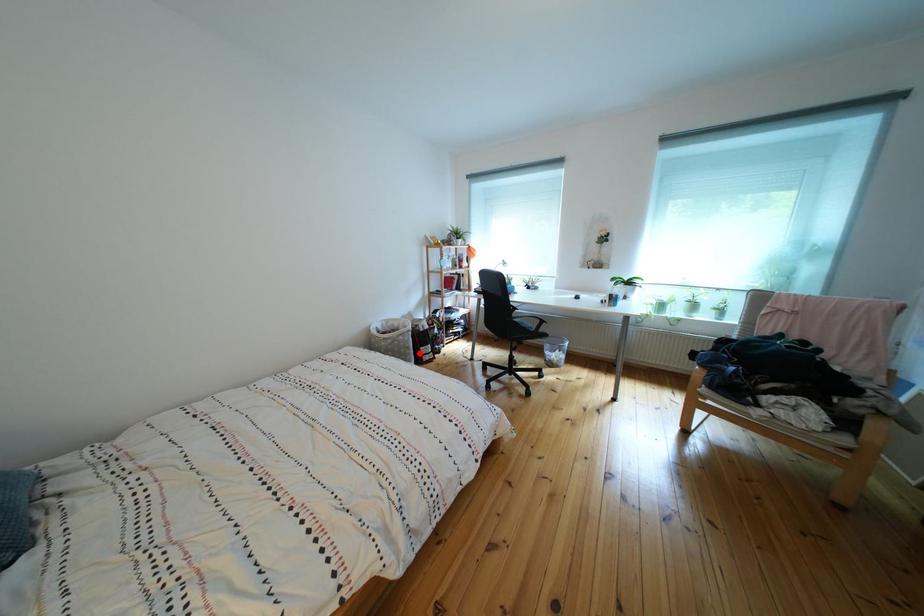
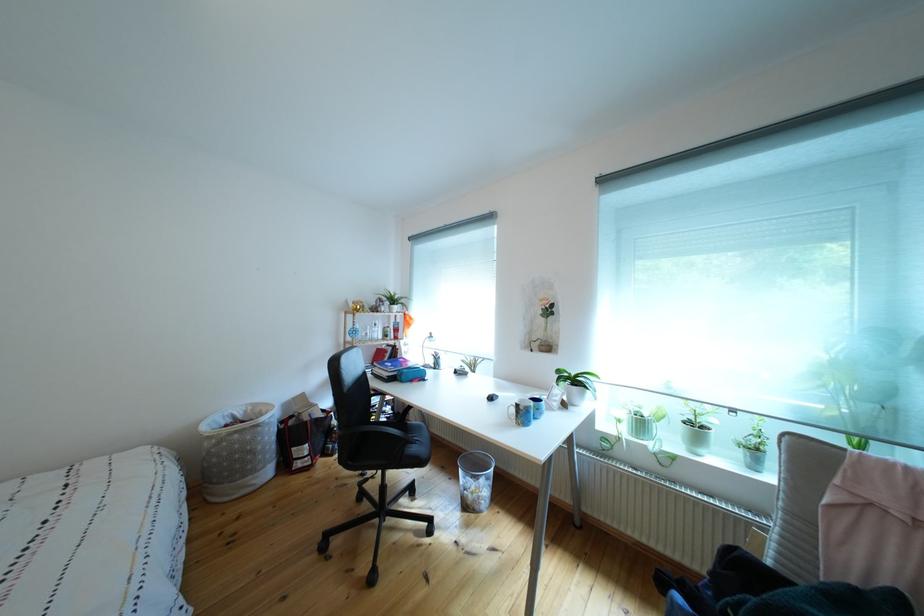
Locate, in the second image, the point that corresponds to the highlighted location in the first image.

(263, 456)